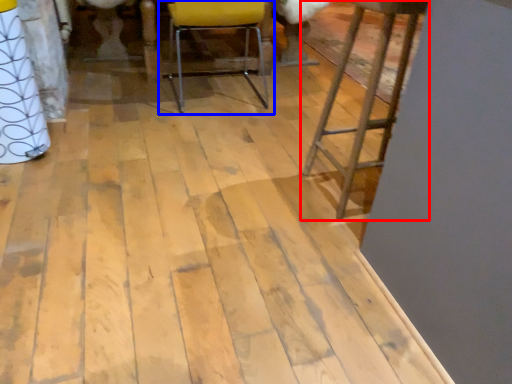
Question: Among these objects, which one is farthest to the camera, furniture (highlighted by a red box) or chair (highlighted by a blue box)?

Choices:
 (A) furniture
 (B) chair

Answer: (B)